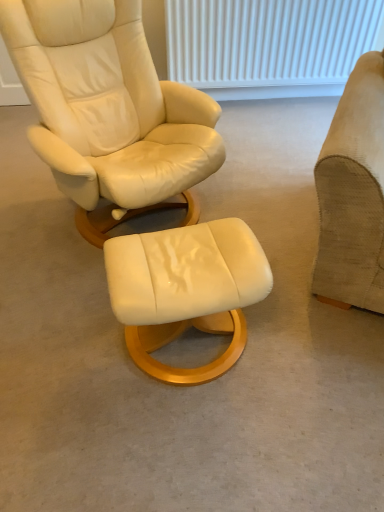
Locate an element on the screen. This screenshot has width=384, height=512. free point in front of matte cream leather stool at center is located at coordinates (190, 443).